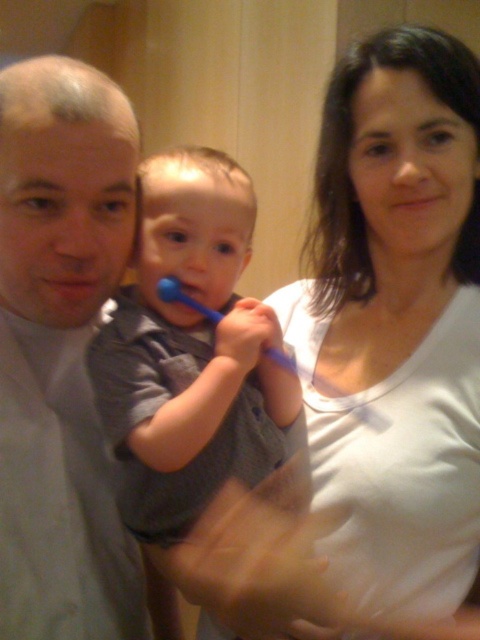
Does dry matte lips at center appear on the left side of smooth skin mouth at upper right?

Correct, you'll find dry matte lips at center to the left of smooth skin mouth at upper right.

Does dry matte lips at center have a greater width compared to smooth skin mouth at upper right?

Incorrect, dry matte lips at center's width does not surpass smooth skin mouth at upper right's.

Find the location of a particular element. dry matte lips at center is located at coordinates (72, 285).

Find the location of a particular element. The image size is (480, 640). dry matte lips at center is located at coordinates (72, 285).

Does matte gray shirt at left appear under dry matte lips at center?

Indeed, matte gray shirt at left is positioned under dry matte lips at center.

Does matte gray shirt at left have a lesser height compared to dry matte lips at center?

In fact, matte gray shirt at left may be taller than dry matte lips at center.

Between point (48, 385) and point (50, 161), which one is positioned behind?

Positioned behind is point (48, 385).

Where is `matte gray shirt at left`? Image resolution: width=480 pixels, height=640 pixels. matte gray shirt at left is located at coordinates (63, 310).

Looking at this image, does matte gray shirt at left appear on the right side of smooth skin mouth at upper right?

Incorrect, matte gray shirt at left is not on the right side of smooth skin mouth at upper right.

Who is more forward, (29, 355) or (408, 77)?

Point (408, 77) is more forward.

Who is more distant from viewer, (71, 209) or (416, 208)?

The point (416, 208) is behind.

Locate an element on the screen. The height and width of the screenshot is (640, 480). matte gray shirt at left is located at coordinates (63, 310).